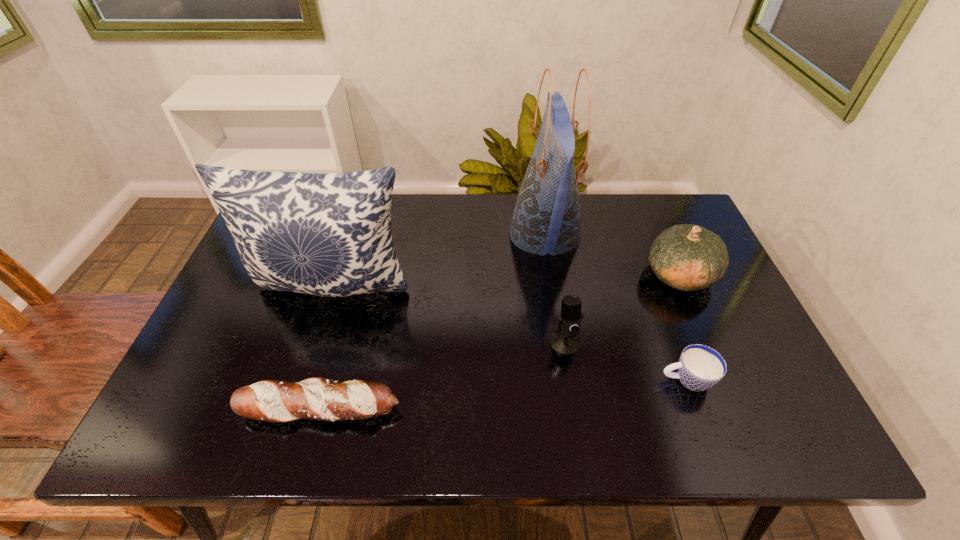
This screenshot has height=540, width=960. Find the location of `free space located 0.230m on the back of the baguet`. free space located 0.230m on the back of the baguet is located at coordinates (347, 310).

Image resolution: width=960 pixels, height=540 pixels. What are the coordinates of `vacant space located 0.200m on the side of the cup with the handle` in the screenshot? It's located at (572, 380).

What are the coordinates of `blank space located on the side of the cup with the handle` in the screenshot? It's located at (546, 380).

Where is `vacant region located on the side of the cup with the handle`? Image resolution: width=960 pixels, height=540 pixels. vacant region located on the side of the cup with the handle is located at coordinates (490, 380).

Identify the location of object that is at the far edge. (546, 219).

This screenshot has width=960, height=540. Identify the location of object at the near edge. (317, 398).

Identify the location of cushion situated at the left edge. Image resolution: width=960 pixels, height=540 pixels. (328, 234).

At what (x,y) coordinates should I click in order to perform the action: click on baguet at the left edge. Please return your answer as a coordinate pair (x, y). The width and height of the screenshot is (960, 540). Looking at the image, I should click on (317, 398).

I want to click on gourd located in the right edge section of the desktop, so click(687, 257).

Locate an element on the screen. The height and width of the screenshot is (540, 960). cup that is at the right edge is located at coordinates (700, 367).